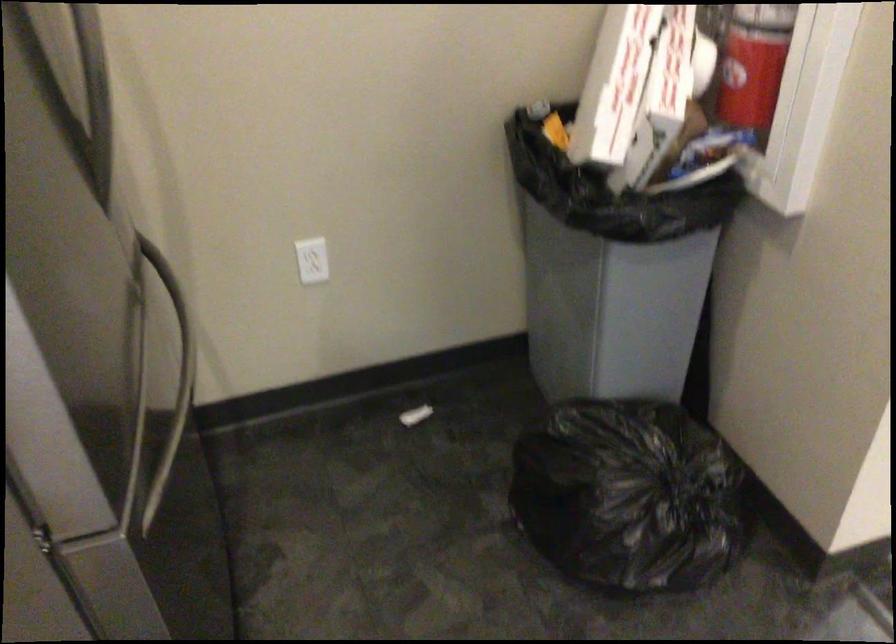
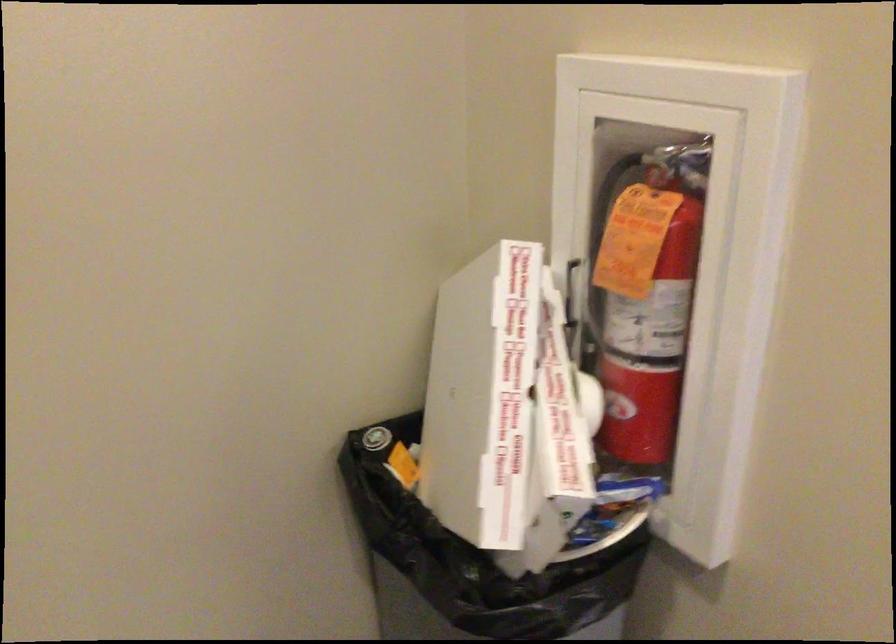
Question: How did the camera likely rotate?

Choices:
 (A) Left
 (B) Right
 (C) Up
 (D) Down

Answer: (B)